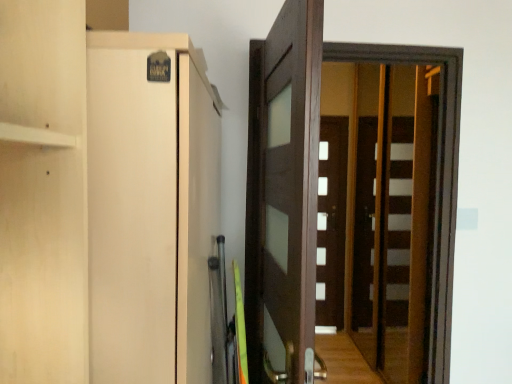
Question: In terms of size, does white matte door at center, the first door in the back-to-front sequence, appear bigger or smaller than brown wooden screen door at center?

Choices:
 (A) small
 (B) big

Answer: (A)

Question: Looking at their shapes, would you say white matte door at center, the first door in the back-to-front sequence, is wider or thinner than brown wooden screen door at center?

Choices:
 (A) thin
 (B) wide

Answer: (B)

Question: Based on their relative distances, which object is farther from the white matte door at center, the first door in the back-to-front sequence?

Choices:
 (A) matte wood cabinet at left
 (B) dark wood door at center, acting as the second door starting from the back
 (C) brown wooden screen door at center

Answer: (A)

Question: Estimate the real-world distances between objects in this image. Which object is closer to the white matte door at center, positioned as the second door in front-to-back order?

Choices:
 (A) dark wood door at center, the 2th door from the right
 (B) brown wooden screen door at center
 (C) matte wood cabinet at left

Answer: (B)